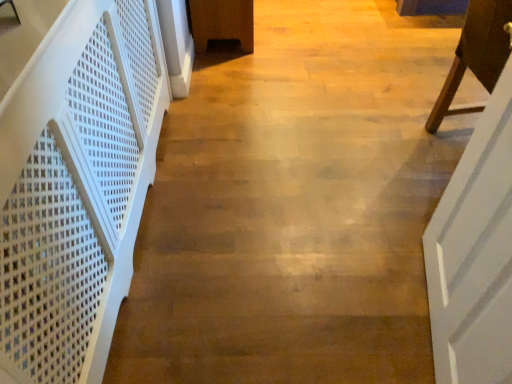
Question: Is white wooden door at right not inside brown wooden chair at right?

Choices:
 (A) no
 (B) yes

Answer: (B)

Question: Is white wooden door at right aimed at brown wooden chair at right?

Choices:
 (A) no
 (B) yes

Answer: (A)

Question: From a real-world perspective, is white wooden door at right on top of brown wooden chair at right?

Choices:
 (A) no
 (B) yes

Answer: (B)

Question: Considering the relative sizes of white wooden door at right and brown wooden chair at right in the image provided, is white wooden door at right taller than brown wooden chair at right?

Choices:
 (A) no
 (B) yes

Answer: (B)

Question: Is white wooden door at right to the right of brown wooden chair at right from the viewer's perspective?

Choices:
 (A) no
 (B) yes

Answer: (A)

Question: Is white plastic stairwell at left bigger or smaller than brown wooden chair at right?

Choices:
 (A) big
 (B) small

Answer: (A)

Question: Do you think white plastic stairwell at left is within brown wooden chair at right, or outside of it?

Choices:
 (A) inside
 (B) outside

Answer: (B)

Question: From a real-world perspective, is white plastic stairwell at left physically located above or below brown wooden chair at right?

Choices:
 (A) below
 (B) above

Answer: (B)

Question: Is white plastic stairwell at left wider or thinner than brown wooden chair at right?

Choices:
 (A) wide
 (B) thin

Answer: (B)

Question: From the image's perspective, is brown wooden chair at right positioned above or below white wooden door at right?

Choices:
 (A) below
 (B) above

Answer: (B)

Question: Visually, is brown wooden chair at right positioned to the left or to the right of white wooden door at right?

Choices:
 (A) right
 (B) left

Answer: (A)

Question: Is point (481, 31) closer or farther from the camera than point (478, 195)?

Choices:
 (A) farther
 (B) closer

Answer: (A)

Question: Based on their sizes in the image, would you say brown wooden chair at right is bigger or smaller than white wooden door at right?

Choices:
 (A) big
 (B) small

Answer: (A)

Question: Is point (138, 132) positioned closer to the camera than point (448, 340)?

Choices:
 (A) closer
 (B) farther

Answer: (B)

Question: From the image's perspective, is white plastic stairwell at left above or below white wooden door at right?

Choices:
 (A) below
 (B) above

Answer: (B)